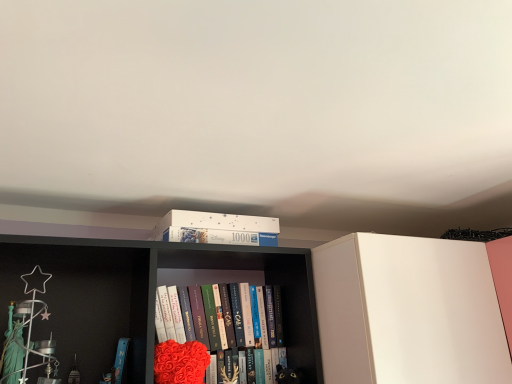
Measure the distance between point (222, 232) and camera.

The depth of point (222, 232) is 4.37 feet.

The height and width of the screenshot is (384, 512). I want to click on white cardboard puzzle box at upper center, so click(216, 228).

In order to face velvety red heart at center, should I rotate leftwards or rightwards?

Rotate left and turn 9.022 degrees.

What do you see at coordinates (180, 362) in the screenshot?
I see `velvety red heart at center` at bounding box center [180, 362].

This screenshot has width=512, height=384. Find the location of `hardcover book at center`. hardcover book at center is located at coordinates (173, 337).

Looking at this image, could you tell me if velvety red heart at center is facing white matte puzzle box at upper center?

Yes, velvety red heart at center is facing white matte puzzle box at upper center.

Is velvety red heart at center taller than white matte puzzle box at upper center?

In fact, velvety red heart at center may be shorter than white matte puzzle box at upper center.

Is velvety red heart at center at the left side of white matte puzzle box at upper center?

No.

In order to click on bookcase located above the velvety red heart at center (from the image's perspective) in this screenshot , I will do `click(282, 303)`.

In the scene shown: Can we say velvety red heart at center lies outside white cardboard puzzle box at upper center?

Yes, velvety red heart at center is located beyond the bounds of white cardboard puzzle box at upper center.

Which of these two, velvety red heart at center or white cardboard puzzle box at upper center, is bigger?

velvety red heart at center.

Considering the relative sizes of velvety red heart at center and white cardboard puzzle box at upper center in the image provided, is velvety red heart at center shorter than white cardboard puzzle box at upper center?

No.

From the image's perspective, is velvety red heart at center located above white cardboard puzzle box at upper center?

Incorrect, from the image's perspective, velvety red heart at center is lower than white cardboard puzzle box at upper center.

Is white matte puzzle box at upper center oriented away from velvety red heart at center?

No.

Looking at this image, from a real-world perspective, is white matte puzzle box at upper center located beneath velvety red heart at center?

No, from a real-world perspective, white matte puzzle box at upper center is not below velvety red heart at center.

Considering the positions of points (95, 339) and (180, 378), is point (95, 339) farther from camera compared to point (180, 378)?

Yes, it is behind point (180, 378).

Which of these two, white matte puzzle box at upper center or velvety red heart at center, stands taller?

white matte puzzle box at upper center.

Is hardcover book at center closer to camera compared to velvety red heart at center?

No, it is not.

Consider the image. Based on their sizes in the image, would you say hardcover book at center is bigger or smaller than velvety red heart at center?

Considering their sizes, hardcover book at center takes up more space than velvety red heart at center.

From the image's perspective, which one is positioned lower, hardcover book at center or velvety red heart at center?

velvety red heart at center.

Is velvety red heart at center at the back of hardcover book at center?

No.

Does white cardboard puzzle box at upper center touch hardcover book at center?

white cardboard puzzle box at upper center and hardcover book at center are clearly separated.

Is white cardboard puzzle box at upper center positioned before hardcover book at center?

That is False.

Which is more to the left, white cardboard puzzle box at upper center or hardcover book at center?

From the viewer's perspective, hardcover book at center appears more on the left side.

Which object is closer to the camera, hardcover book at center or white cardboard puzzle box at upper center?

Positioned in front is hardcover book at center.

From a real-world perspective, is hardcover book at center located higher than white cardboard puzzle box at upper center?

No, from a real-world perspective, hardcover book at center is not above white cardboard puzzle box at upper center.

Is hardcover book at center far from white cardboard puzzle box at upper center?

They are positioned close to each other.

Is hardcover book at center at the back of velvety red heart at center?

Yes, velvety red heart at center's orientation is away from hardcover book at center.

Which of these two, velvety red heart at center or hardcover book at center, is bigger?

With larger size is hardcover book at center.

Is velvety red heart at center taller or shorter than hardcover book at center?

In the image, velvety red heart at center appears to be shorter than hardcover book at center.

From the image's perspective, which object appears higher, velvety red heart at center or hardcover book at center?

hardcover book at center.

Find the location of `bookcase that appears on the left of velvety red heart at center`. bookcase that appears on the left of velvety red heart at center is located at coordinates (282, 303).

Identify the location of flower in front of the white cardboard puzzle box at upper center. (180, 362).

Based on their spatial positions, is white matte puzzle box at upper center or velvety red heart at center closer to hardcover book at center?

Among the two, velvety red heart at center is located nearer to hardcover book at center.

From the image, which object appears to be farther from velvety red heart at center, white cardboard puzzle box at upper center or hardcover book at center?

Among the two, white cardboard puzzle box at upper center is located further to velvety red heart at center.

From the image, which object appears to be farther from velvety red heart at center, white cardboard puzzle box at upper center or white matte puzzle box at upper center?

Among the two, white matte puzzle box at upper center is located further to velvety red heart at center.

Considering their positions, is white matte puzzle box at upper center positioned closer to velvety red heart at center than white cardboard puzzle box at upper center?

white cardboard puzzle box at upper center lies closer to velvety red heart at center than the other object.

Which object lies further to the anchor point white cardboard puzzle box at upper center, hardcover book at center or velvety red heart at center?

velvety red heart at center lies further to white cardboard puzzle box at upper center than the other object.

Considering their positions, is velvety red heart at center positioned further to white cardboard puzzle box at upper center than hardcover book at center?

Among the two, velvety red heart at center is located further to white cardboard puzzle box at upper center.

When comparing their distances from hardcover book at center, does white matte puzzle box at upper center or white cardboard puzzle box at upper center seem closer?

white matte puzzle box at upper center lies closer to hardcover book at center than the other object.

When comparing their distances from velvety red heart at center, does hardcover book at center or white cardboard puzzle box at upper center seem closer?

The object closer to velvety red heart at center is hardcover book at center.

The height and width of the screenshot is (384, 512). I want to click on bookcase that lies between white cardboard puzzle box at upper center and velvety red heart at center from top to bottom, so click(282, 303).

Identify the location of flower between white matte puzzle box at upper center and hardcover book at center along the z-axis. Image resolution: width=512 pixels, height=384 pixels. (180, 362).

I want to click on book positioned between white matte puzzle box at upper center and white cardboard puzzle box at upper center from near to far, so click(x=173, y=337).

Where is `book between white cardboard puzzle box at upper center and velvety red heart at center from top to bottom`? This screenshot has width=512, height=384. book between white cardboard puzzle box at upper center and velvety red heart at center from top to bottom is located at coordinates [x=173, y=337].